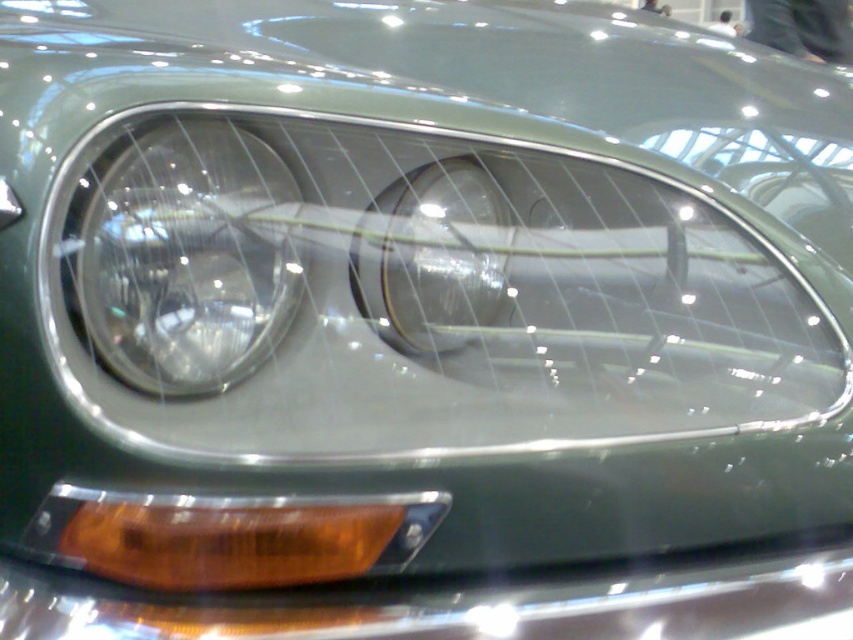
You are an auto mechanic inspecting the car headlight assembly. You notice the translucent amber plastic at lower left and the clear glass headlight at center. Which object is shorter in height?

The translucent amber plastic at lower left is not as tall as the clear glass headlight at center, so the translucent amber plastic at lower left is shorter in height.

You are an auto mechanic inspecting the car headlight assembly. You need to compare the size of the translucent amber plastic at lower left and the clear glass headlight at center. Which one has a greater width?

The translucent amber plastic at lower left has a greater width than the clear glass headlight at center.

You are a mechanic inspecting a car headlight assembly. You notice the clear glass headlight at left and the translucent amber plastic at lower left. Which object is positioned higher in the assembly?

The clear glass headlight at left is located above the translucent amber plastic at lower left, so it is positioned higher in the assembly.